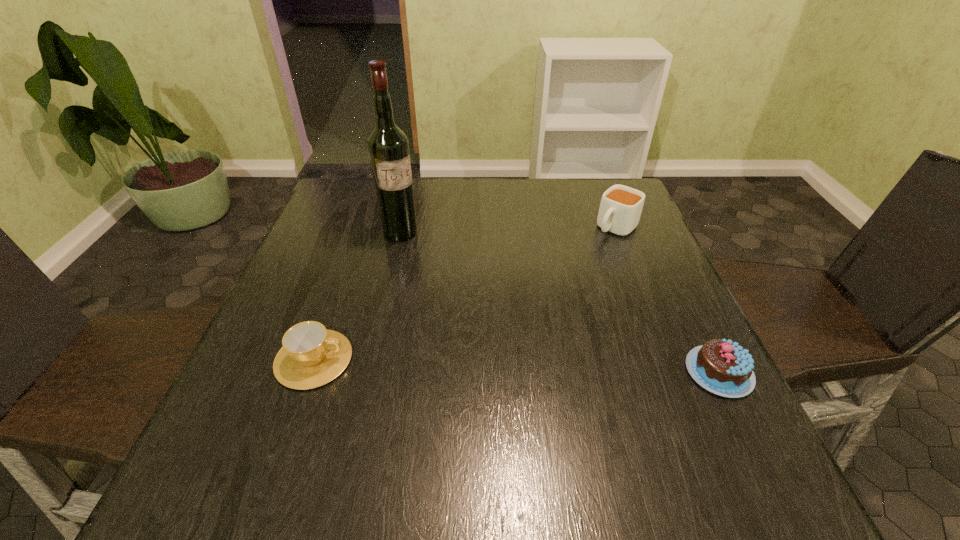
Find the location of a particular element. The image size is (960, 540). object that is at the near right corner is located at coordinates (721, 366).

Where is `vacant space at the far edge`? The image size is (960, 540). vacant space at the far edge is located at coordinates (435, 184).

In the image, there is a desktop. What are the coordinates of `vacant space at the left edge` in the screenshot? It's located at (357, 232).

This screenshot has width=960, height=540. In the image, there is a desktop. In order to click on vacant space at the right edge in this screenshot , I will do `click(684, 373)`.

The height and width of the screenshot is (540, 960). In order to click on free space at the far left corner of the desktop in this screenshot , I will do `click(348, 208)`.

Where is `vacant region at the near left corner of the desktop`? vacant region at the near left corner of the desktop is located at coordinates pyautogui.click(x=284, y=395).

This screenshot has height=540, width=960. In the image, there is a desktop. Find the location of `vacant space at the far right corner`. vacant space at the far right corner is located at coordinates (583, 213).

Where is `free space at the near right corner of the desktop`? This screenshot has height=540, width=960. free space at the near right corner of the desktop is located at coordinates (671, 408).

The image size is (960, 540). What are the coordinates of `empty space that is in between the right cup and the chocolate cake` in the screenshot? It's located at (667, 300).

You are a GUI agent. You are given a task and a screenshot of the screen. Output one action in this format:
    pyautogui.click(x=<x>, y=<y>)
    Task: Click on the vacant region between the tallest object and the taller cup
    
    Given the screenshot: What is the action you would take?
    pyautogui.click(x=509, y=231)